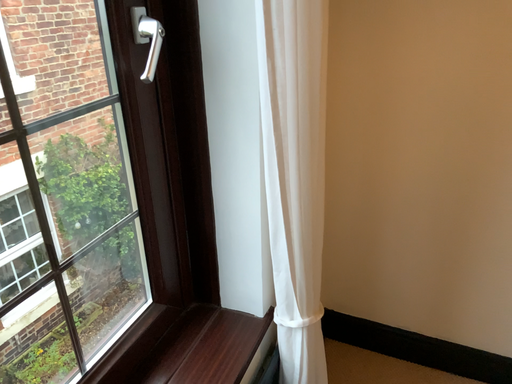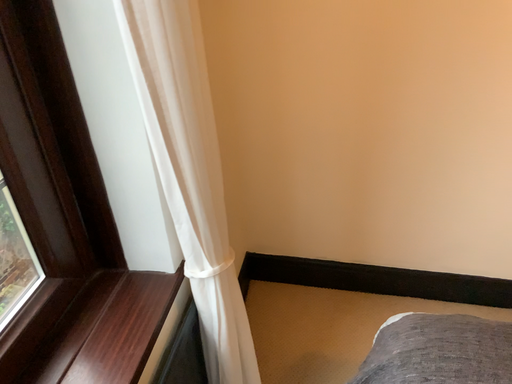
Question: Which way did the camera rotate in the video?

Choices:
 (A) rotated left
 (B) rotated right

Answer: (B)